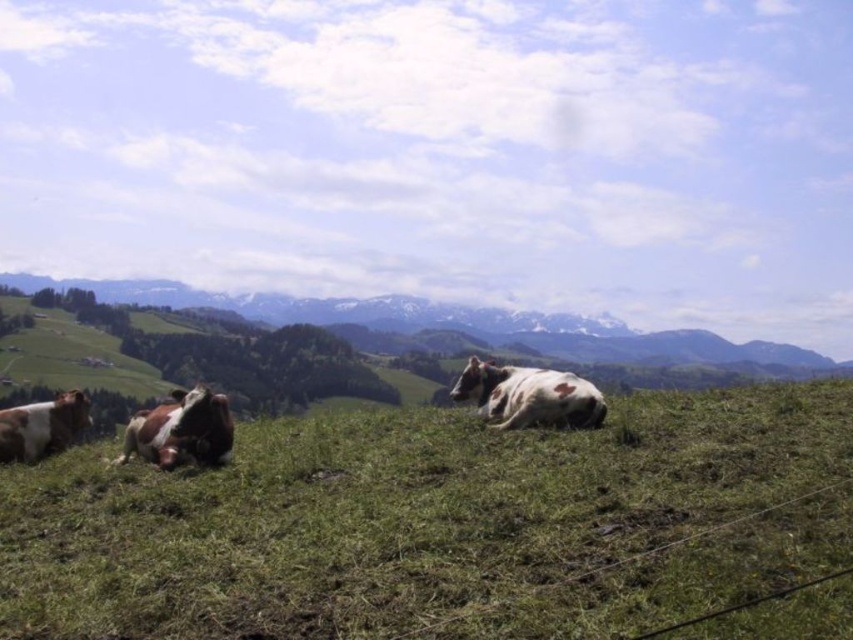
You are a farmer checking the pasture. You see the green grassy field at center and the white and brown spotted cow at left. Which object is lower in the image?

The green grassy field at center is located below the white and brown spotted cow at left, so the green grassy field at center is lower in the image.

You are a photographer standing at the edge of the green grassy field at center and want to take a picture of the white spotted cow at center. Which direction should you move to position the cow to your right side in the photo?

The green grassy field at center is to the left of the white spotted cow at center. To have the cow to your right in the photo, you should move to the left side of the green grassy field at center so that the cow appears on your right side.

You are standing in the pastoral scene looking at the mountains. You see two points marked in the image. Which point is closer to you, point (x=550, y=390) or point (x=26, y=432)?

Point (x=550, y=390) is closer to the viewer than point (x=26, y=432).